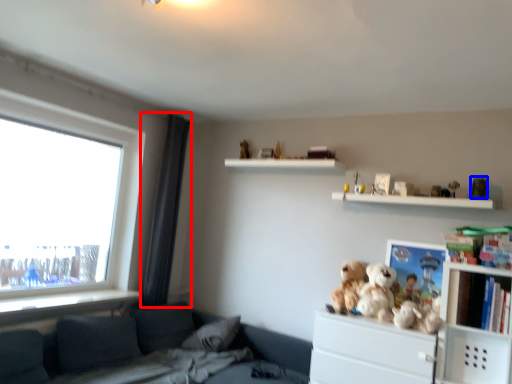
Question: Which of the following is the closest to the observer, curtain (highlighted by a red box) or toy (highlighted by a blue box)?

Choices:
 (A) curtain
 (B) toy

Answer: (B)